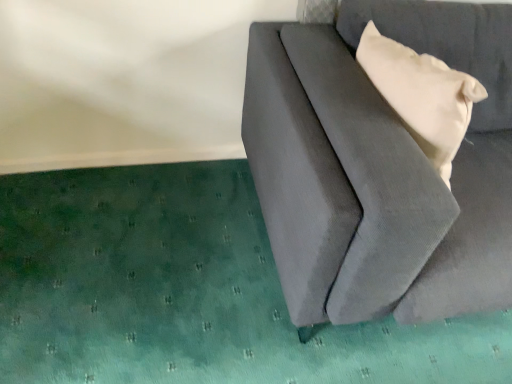
Question: Is suede gray couch at right to the left or to the right of matte beige pillow at upper right in the image?

Choices:
 (A) right
 (B) left

Answer: (A)

Question: From a real-world perspective, is suede gray couch at right positioned above or below matte beige pillow at upper right?

Choices:
 (A) above
 (B) below

Answer: (B)

Question: Considering the positions of point (315, 246) and point (415, 125), is point (315, 246) closer or farther from the camera than point (415, 125)?

Choices:
 (A) closer
 (B) farther

Answer: (A)

Question: From their relative heights in the image, would you say matte beige pillow at upper right is taller or shorter than suede gray couch at right?

Choices:
 (A) tall
 (B) short

Answer: (B)

Question: From the image's perspective, is matte beige pillow at upper right above or below suede gray couch at right?

Choices:
 (A) below
 (B) above

Answer: (B)

Question: Relative to suede gray couch at right, is matte beige pillow at upper right in front or behind?

Choices:
 (A) front
 (B) behind

Answer: (B)

Question: From a real-world perspective, relative to suede gray couch at right, is matte beige pillow at upper right vertically above or below?

Choices:
 (A) below
 (B) above

Answer: (B)